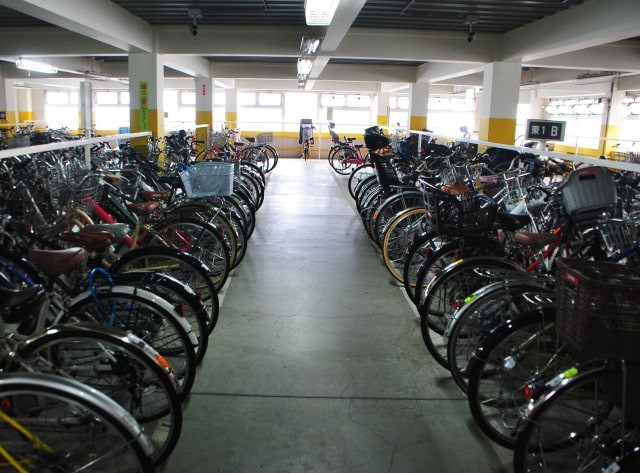
This screenshot has width=640, height=473. I want to click on ceiling, so click(x=24, y=22), click(x=248, y=16), click(x=433, y=21), click(x=607, y=39).